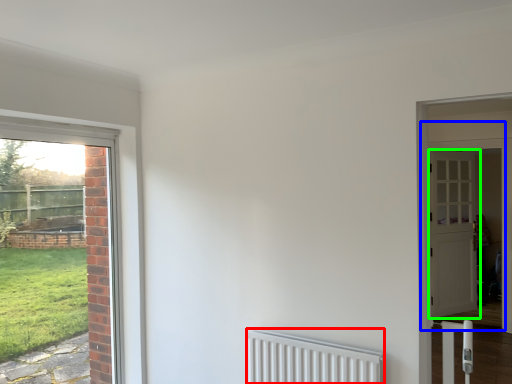
Question: Which is farther away from radiator (highlighted by a red box)? door (highlighted by a blue box) or door (highlighted by a green box)?

Choices:
 (A) door
 (B) door

Answer: (B)